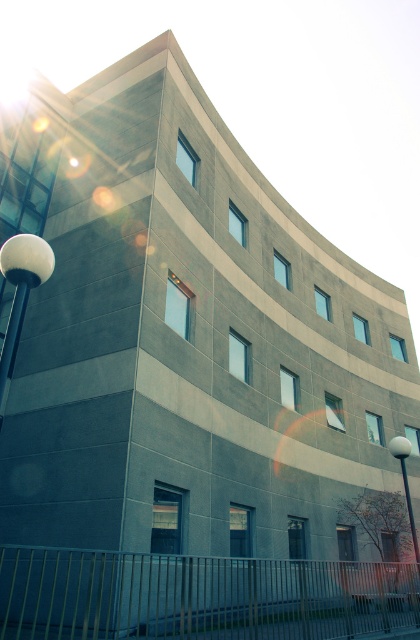
You are standing in front of the modern building and notice two points marked on its facade. The first point is at coordinate point (x=10, y=340) and the second is at point (x=414, y=531). Which point is closer to you?

Point (x=10, y=340) is closer to the viewer than point (x=414, y=531).

You are standing in front of the modern building and notice the white glossy sphere at upper left and the white glossy lamp post at lower right. Which object is closer to you based on their positions?

The white glossy sphere at upper left is closer to you because it is in front of the white glossy lamp post at lower right.

You are standing at the base of the building and want to place a new decorative item between the white glossy sphere at upper left and the white glossy lamp post at lower right. If the decorative item requires a minimum of 5 meters of space, will there be enough room?

The distance between the white glossy sphere at upper left and the white glossy lamp post at lower right is 8.71 meters, which is more than the required 5 meters. Therefore, there is sufficient space to place the decorative item.